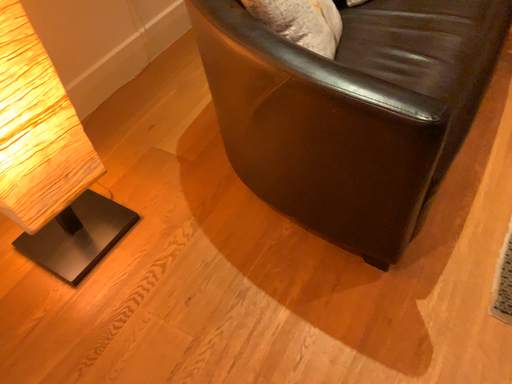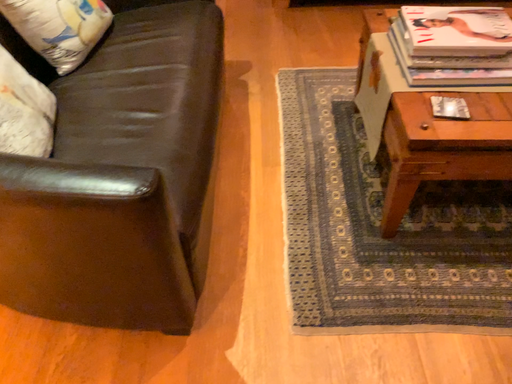
Question: Which way did the camera rotate in the video?

Choices:
 (A) rotated left
 (B) rotated right

Answer: (B)